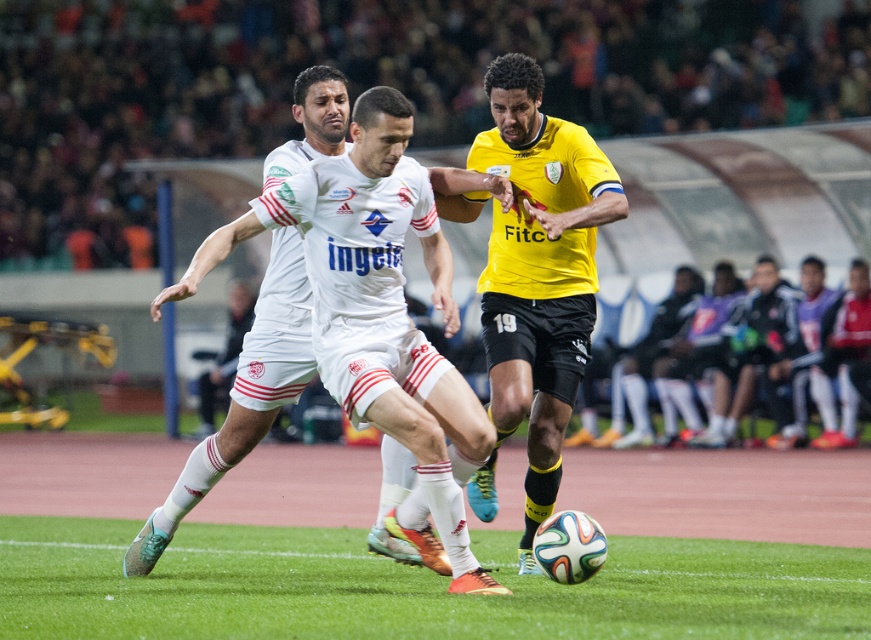
You are a soccer fan watching the match. You want to locate the player wearing the white matte jersey at center. Where should you look on the field?

You should look at point (379, 314) on the field to locate the white matte jersey at center.

You are a soccer referee observing the match. You need to determine if the white matte jersey at center is wider than the yellow matte jersey at center. Based on the scene description, can you confirm this?

The white matte jersey at center might be wider than yellow matte jersey at center according to the description.